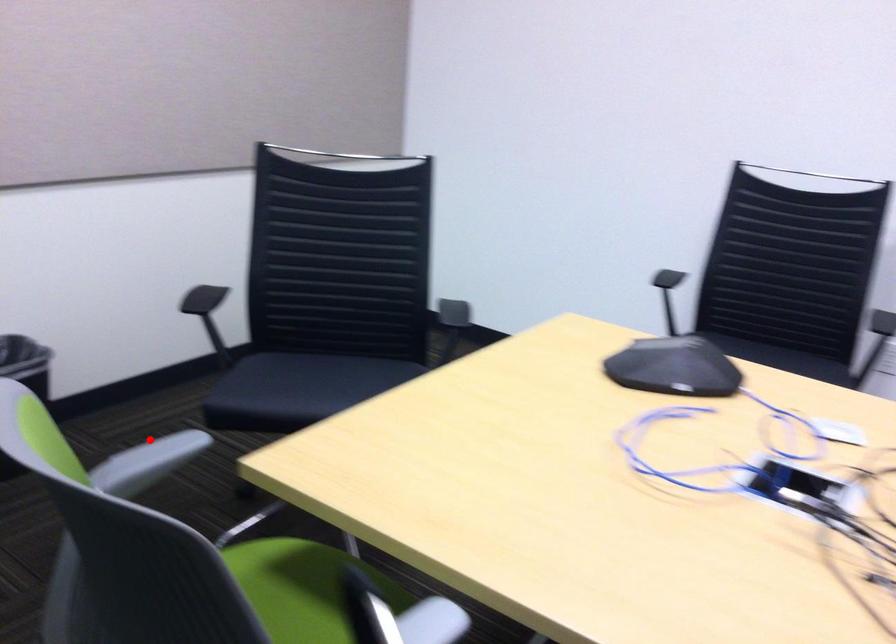
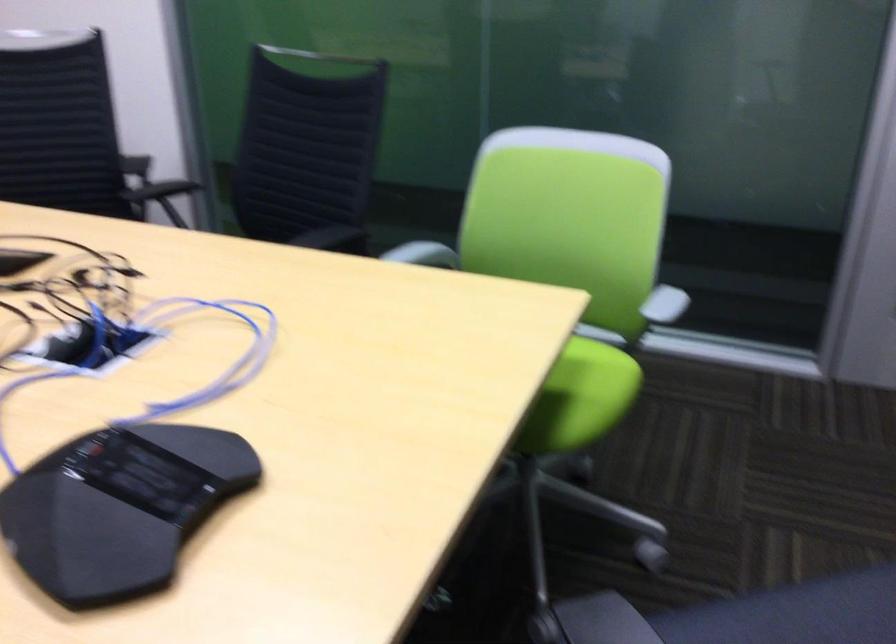
Question: I am providing you with two images of the same scene from different viewpoints. In image1, a red point is highlighted. Considering the same 3D point in image2, which of the following is correct?

Choices:
 (A) It is closer
 (B) It is farther

Answer: (B)